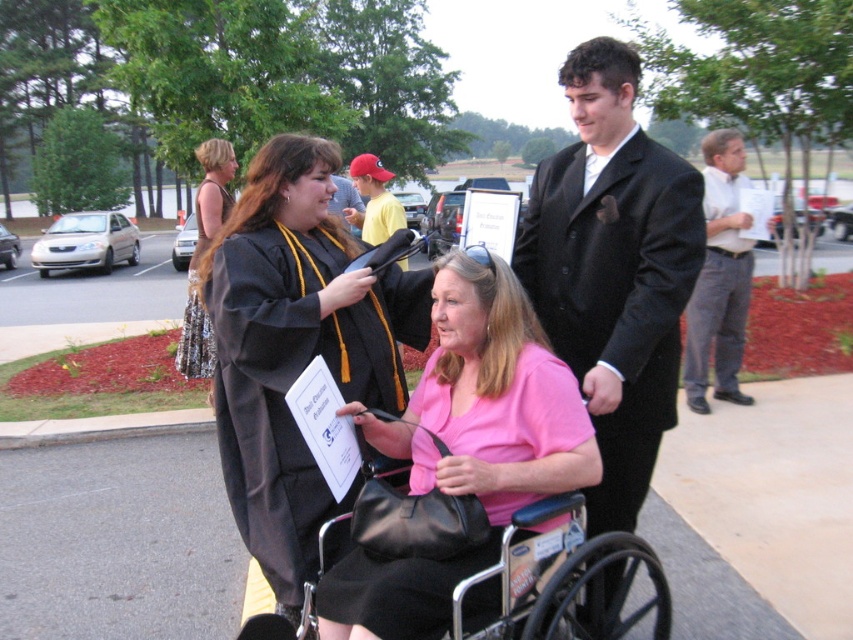
Which of these two, white shirt at upper right or yellow cotton shirt at center, stands shorter?

yellow cotton shirt at center

Does white shirt at upper right have a greater height compared to yellow cotton shirt at center?

Yes.

Which is in front, point (721, 340) or point (370, 192)?

Point (721, 340)

Where is `white shirt at upper right`? This screenshot has height=640, width=853. white shirt at upper right is located at coordinates (720, 276).

Is pink matte dress at center positioned behind white shirt at upper right?

No, pink matte dress at center is closer to the viewer.

The height and width of the screenshot is (640, 853). Identify the location of pink matte dress at center. (465, 445).

Does pink matte dress at center have a lesser width compared to yellow cotton shirt at center?

Incorrect, pink matte dress at center's width is not less than yellow cotton shirt at center's.

Is pink matte dress at center to the left of yellow cotton shirt at center from the viewer's perspective?

Incorrect, pink matte dress at center is not on the left side of yellow cotton shirt at center.

What do you see at coordinates (465, 445) in the screenshot? I see `pink matte dress at center` at bounding box center [465, 445].

Locate an element on the screen. This screenshot has width=853, height=640. pink matte dress at center is located at coordinates tap(465, 445).